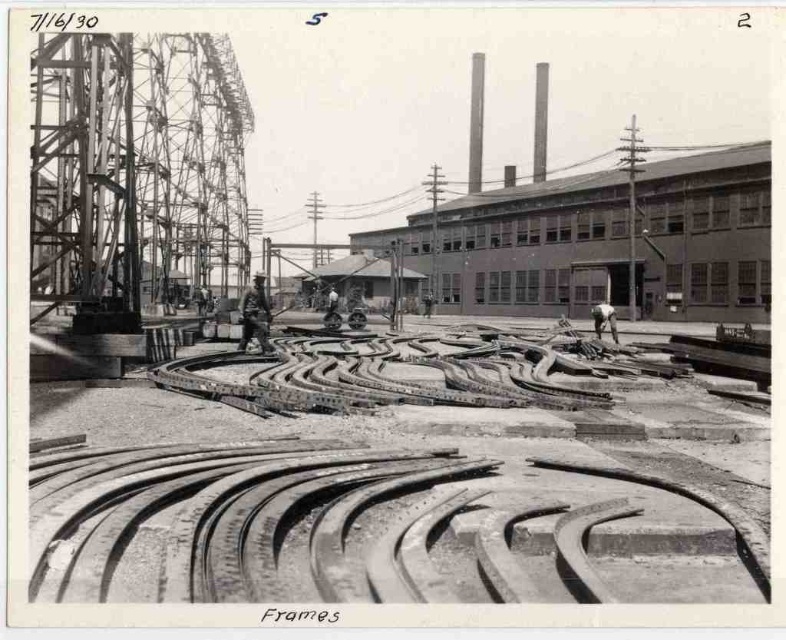
Which is behind, point (37, 563) or point (245, 308)?

The point (245, 308) is more distant.

Can you confirm if smooth concrete frames at center is wider than dark gray uniform at center?

Correct, the width of smooth concrete frames at center exceeds that of dark gray uniform at center.

Is point (288, 534) less distant than point (256, 275)?

Yes, point (288, 534) is closer to viewer.

Image resolution: width=786 pixels, height=640 pixels. I want to click on smooth concrete frames at center, so click(x=373, y=529).